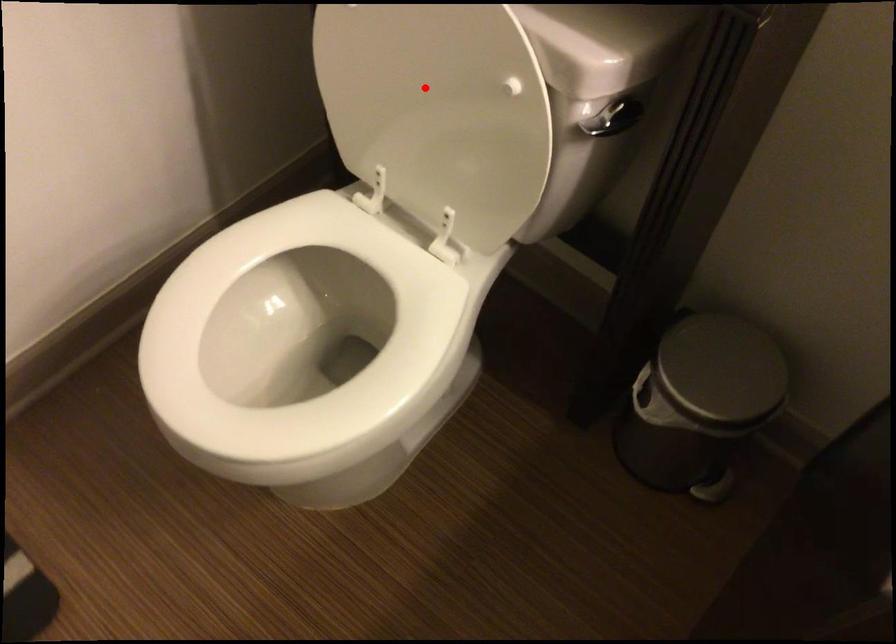
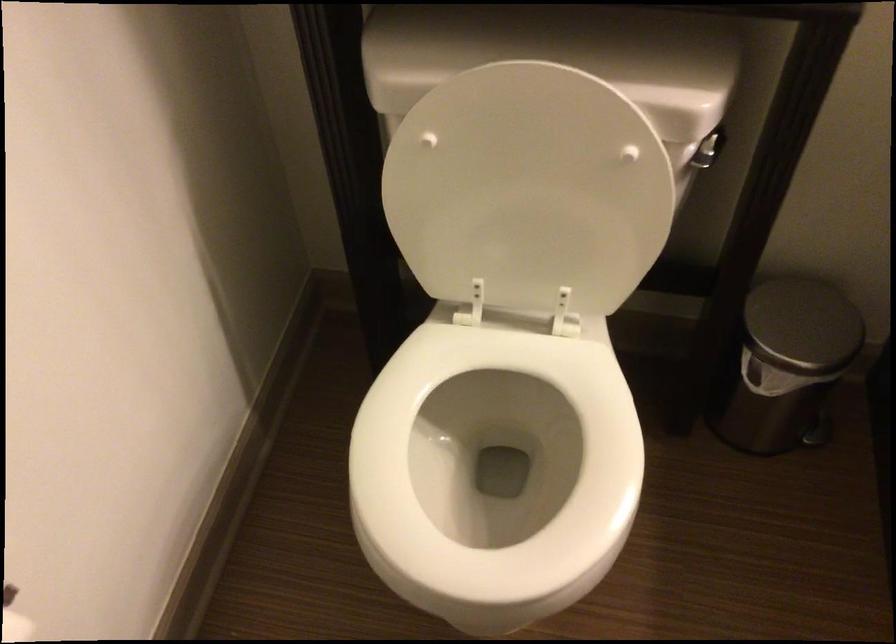
Find the pixel in the second image that matches the highlighted location in the first image.

(528, 189)